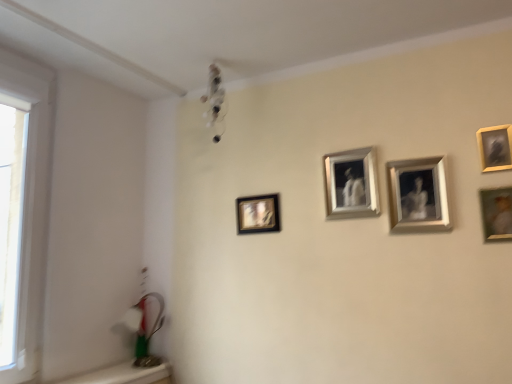
Describe the element at coordinates (495, 147) in the screenshot. The width and height of the screenshot is (512, 384). I see `wooden frame at upper right, which is counted as the second picture frame, starting from the right` at that location.

You are a GUI agent. You are given a task and a screenshot of the screen. Output one action in this format:
    pyautogui.click(x=<x>, y=<y>)
    Task: Click on the metallic silver picture frame at upper right, which is the 3th picture frame in left-to-right order
    The height and width of the screenshot is (384, 512).
    Given the screenshot: What is the action you would take?
    pyautogui.click(x=418, y=195)

This screenshot has width=512, height=384. What do you see at coordinates (258, 214) in the screenshot?
I see `matte black picture frame at center left, the first picture frame from the left` at bounding box center [258, 214].

You are a GUI agent. You are given a task and a screenshot of the screen. Output one action in this format:
    pyautogui.click(x=<x>, y=<y>)
    Task: Click on the matte silver picture frame at right, marked as the 1th picture frame in a right-to-left arrangement
    This screenshot has height=384, width=512.
    Given the screenshot: What is the action you would take?
    pyautogui.click(x=496, y=213)

Find the location of `silver metallic frame at center, the 4th picture frame when ordered from right to left`. silver metallic frame at center, the 4th picture frame when ordered from right to left is located at coordinates (351, 184).

Find the location of a particular element. The image size is (512, 384). transparent glass window at left is located at coordinates (31, 206).

What are the coordinates of `the 3rd picture frame in front of the matte black picture frame at center left, positioned as the 5th picture frame in right-to-left order, starting your count from the anchor` in the screenshot? It's located at (495, 147).

From the image's perspective, which object appears higher, wooden frame at upper right, which is counted as the second picture frame, starting from the right, or matte black picture frame at center left, positioned as the 5th picture frame in right-to-left order?

wooden frame at upper right, which is counted as the second picture frame, starting from the right, is shown above in the image.

Which is correct: wooden frame at upper right, which is the 4th picture frame in left-to-right order, is inside matte black picture frame at center left, positioned as the 5th picture frame in right-to-left order, or outside of it?

wooden frame at upper right, which is the 4th picture frame in left-to-right order, lies outside matte black picture frame at center left, positioned as the 5th picture frame in right-to-left order.

Between wooden frame at upper right, which is the 4th picture frame in left-to-right order, and matte black picture frame at center left, the first picture frame from the left, which one is positioned behind?

matte black picture frame at center left, the first picture frame from the left, is further from the camera.

Does matte black picture frame at center left, the first picture frame from the left, appear on the right side of wooden frame at upper right, which is counted as the second picture frame, starting from the right?

No.

From the picture: From the image's perspective, is matte black picture frame at center left, positioned as the 5th picture frame in right-to-left order, below wooden frame at upper right, which is the 4th picture frame in left-to-right order?

Yes, from the image's perspective, matte black picture frame at center left, positioned as the 5th picture frame in right-to-left order, is below wooden frame at upper right, which is the 4th picture frame in left-to-right order.

This screenshot has width=512, height=384. I want to click on the 3rd picture frame counting from the right side of the matte black picture frame at center left, positioned as the 5th picture frame in right-to-left order, so click(x=495, y=147).

From a real-world perspective, is matte black picture frame at center left, positioned as the 5th picture frame in right-to-left order, positioned under wooden frame at upper right, which is counted as the second picture frame, starting from the right, based on gravity?

Yes, from a real-world perspective, matte black picture frame at center left, positioned as the 5th picture frame in right-to-left order, is below wooden frame at upper right, which is counted as the second picture frame, starting from the right.

From the matte silver picture frame at right, marked as the 5th picture frame in a left-to-right arrangement, count 1st picture frames backward and point to it. Please provide its 2D coordinates.

[(495, 147)]

Does point (487, 224) come behind point (510, 152)?

Yes.

Looking at this image, does matte silver picture frame at right, marked as the 5th picture frame in a left-to-right arrangement, have a smaller size compared to wooden frame at upper right, which is the 4th picture frame in left-to-right order?

Incorrect, matte silver picture frame at right, marked as the 5th picture frame in a left-to-right arrangement, is not smaller in size than wooden frame at upper right, which is the 4th picture frame in left-to-right order.

Considering the sizes of objects transparent glass window at left and matte silver picture frame at right, marked as the 5th picture frame in a left-to-right arrangement, in the image provided, who is smaller, transparent glass window at left or matte silver picture frame at right, marked as the 5th picture frame in a left-to-right arrangement,?

With smaller size is matte silver picture frame at right, marked as the 5th picture frame in a left-to-right arrangement.

In the scene shown: Is transparent glass window at left turned away from matte silver picture frame at right, marked as the 5th picture frame in a left-to-right arrangement?

No, transparent glass window at left is not facing the opposite direction of matte silver picture frame at right, marked as the 5th picture frame in a left-to-right arrangement.

Which is less distant, (31, 361) or (495, 230)?

Point (31, 361) appears to be farther away from the viewer than point (495, 230).

From a real-world perspective, which is physically below, transparent glass window at left or matte silver picture frame at right, marked as the 5th picture frame in a left-to-right arrangement?

matte silver picture frame at right, marked as the 5th picture frame in a left-to-right arrangement.

Based on their sizes in the image, would you say matte black picture frame at center left, positioned as the 5th picture frame in right-to-left order, is bigger or smaller than matte silver picture frame at right, marked as the 1th picture frame in a right-to-left arrangement?

In the image, matte black picture frame at center left, positioned as the 5th picture frame in right-to-left order, appears to be larger than matte silver picture frame at right, marked as the 1th picture frame in a right-to-left arrangement.

Can you tell me how much matte black picture frame at center left, the first picture frame from the left, and matte silver picture frame at right, marked as the 1th picture frame in a right-to-left arrangement, differ in facing direction?

The facing directions of matte black picture frame at center left, the first picture frame from the left, and matte silver picture frame at right, marked as the 1th picture frame in a right-to-left arrangement, are 1.63 degrees apart.

How far apart are matte black picture frame at center left, the first picture frame from the left, and matte silver picture frame at right, marked as the 1th picture frame in a right-to-left arrangement?

matte black picture frame at center left, the first picture frame from the left, is 37.44 inches from matte silver picture frame at right, marked as the 1th picture frame in a right-to-left arrangement.

Can you confirm if matte black picture frame at center left, positioned as the 5th picture frame in right-to-left order, is taller than matte silver picture frame at right, marked as the 5th picture frame in a left-to-right arrangement?

Yes.

Is metallic silver picture frame at upper right, which is the 3th picture frame in left-to-right order, not close to silver metallic frame at center, the 4th picture frame when ordered from right to left?

That's not correct — metallic silver picture frame at upper right, which is the 3th picture frame in left-to-right order, is a little close to silver metallic frame at center, the 4th picture frame when ordered from right to left.

Can you confirm if metallic silver picture frame at upper right, the third picture frame from the right, is thinner than silver metallic frame at center, the 2th picture frame positioned from the left?

No.

From the image's perspective, count 1st picture frames upward from the metallic silver picture frame at upper right, the third picture frame from the right, and point to it. Please provide its 2D coordinates.

[(351, 184)]

Which is more to the left, wooden frame at upper right, which is the 4th picture frame in left-to-right order, or silver metallic frame at center, the 2th picture frame positioned from the left?

silver metallic frame at center, the 2th picture frame positioned from the left, is more to the left.

From the image's perspective, relative to silver metallic frame at center, the 2th picture frame positioned from the left, is wooden frame at upper right, which is counted as the second picture frame, starting from the right, above or below?

Based on their image positions, wooden frame at upper right, which is counted as the second picture frame, starting from the right, is located above silver metallic frame at center, the 2th picture frame positioned from the left.

Does point (498, 129) lie in front of point (359, 173)?

Yes, point (498, 129) is closer to viewer.

Is wooden frame at upper right, which is counted as the second picture frame, starting from the right, inside the boundaries of silver metallic frame at center, the 2th picture frame positioned from the left, or outside?

The correct answer is: outside.

From the image's perspective, starting from the wooden frame at upper right, which is counted as the second picture frame, starting from the right, which picture frame is the 4th one below? Please provide its 2D coordinates.

[(258, 214)]

From a real-world perspective, starting from the matte black picture frame at center left, positioned as the 5th picture frame in right-to-left order, which picture frame is the 3rd one vertically above it? Please provide its 2D coordinates.

[(495, 147)]

Based on their spatial positions, is metallic silver picture frame at upper right, the third picture frame from the right, or wooden frame at upper right, which is counted as the second picture frame, starting from the right, closer to matte silver picture frame at right, marked as the 1th picture frame in a right-to-left arrangement?

Based on the image, wooden frame at upper right, which is counted as the second picture frame, starting from the right, appears to be nearer to matte silver picture frame at right, marked as the 1th picture frame in a right-to-left arrangement.

Considering their positions, is metallic silver picture frame at upper right, which is the 3th picture frame in left-to-right order, positioned closer to transparent glass window at left than silver metallic frame at center, the 4th picture frame when ordered from right to left?

The object closer to transparent glass window at left is silver metallic frame at center, the 4th picture frame when ordered from right to left.

Based on their spatial positions, is silver metallic frame at center, the 2th picture frame positioned from the left, or metallic silver picture frame at upper right, which is the 3th picture frame in left-to-right order, further from transparent glass window at left?

metallic silver picture frame at upper right, which is the 3th picture frame in left-to-right order, lies further to transparent glass window at left than the other object.

When comparing their distances from matte silver picture frame at right, marked as the 1th picture frame in a right-to-left arrangement, does transparent glass window at left or metallic silver picture frame at upper right, which is the 3th picture frame in left-to-right order, seem further?

Based on the image, transparent glass window at left appears to be further to matte silver picture frame at right, marked as the 1th picture frame in a right-to-left arrangement.

When comparing their distances from matte silver picture frame at right, marked as the 1th picture frame in a right-to-left arrangement, does transparent glass window at left or wooden frame at upper right, which is counted as the second picture frame, starting from the right, seem further?

transparent glass window at left.

Looking at the image, which one is located further to matte black picture frame at center left, positioned as the 5th picture frame in right-to-left order, matte silver picture frame at right, marked as the 5th picture frame in a left-to-right arrangement, or metallic silver picture frame at upper right, the third picture frame from the right?

Among the two, matte silver picture frame at right, marked as the 5th picture frame in a left-to-right arrangement, is located further to matte black picture frame at center left, positioned as the 5th picture frame in right-to-left order.

Considering their positions, is matte black picture frame at center left, positioned as the 5th picture frame in right-to-left order, positioned closer to matte silver picture frame at right, marked as the 5th picture frame in a left-to-right arrangement, than wooden frame at upper right, which is counted as the second picture frame, starting from the right?

Among the two, wooden frame at upper right, which is counted as the second picture frame, starting from the right, is located nearer to matte silver picture frame at right, marked as the 5th picture frame in a left-to-right arrangement.

Considering their positions, is transparent glass window at left positioned further to metallic silver picture frame at upper right, which is the 3th picture frame in left-to-right order, than wooden frame at upper right, which is counted as the second picture frame, starting from the right?

Based on the image, transparent glass window at left appears to be further to metallic silver picture frame at upper right, which is the 3th picture frame in left-to-right order.

The image size is (512, 384). Identify the location of picture frame situated between silver metallic frame at center, the 4th picture frame when ordered from right to left, and wooden frame at upper right, which is counted as the second picture frame, starting from the right, from left to right. (418, 195).

Locate an element on the screen. picture frame between matte black picture frame at center left, the first picture frame from the left, and metallic silver picture frame at upper right, the third picture frame from the right is located at coordinates (351, 184).

Locate an element on the screen. This screenshot has height=384, width=512. picture frame between transparent glass window at left and silver metallic frame at center, the 4th picture frame when ordered from right to left, in the horizontal direction is located at coordinates (258, 214).

The height and width of the screenshot is (384, 512). What are the coordinates of `picture frame situated between metallic silver picture frame at upper right, the third picture frame from the right, and matte silver picture frame at right, marked as the 5th picture frame in a left-to-right arrangement, from left to right` in the screenshot? It's located at (495, 147).